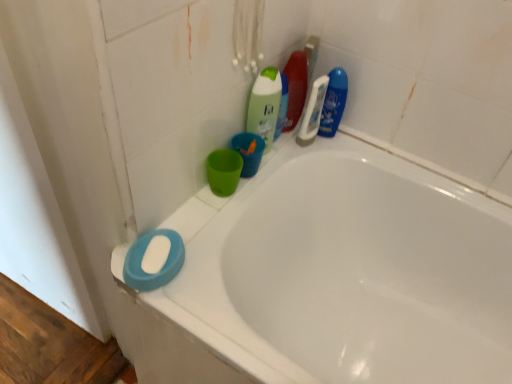
Question: Can you confirm if green matte bottle at upper center, the fourth cleaning product when ordered from right to left, is positioned to the left of white matte soap at lower left?

Choices:
 (A) yes
 (B) no

Answer: (B)

Question: Is green matte bottle at upper center, the first cleaning product positioned from the left, not close to white matte soap at lower left?

Choices:
 (A) yes
 (B) no

Answer: (B)

Question: Is green matte bottle at upper center, the fourth cleaning product when ordered from right to left, facing away from white matte soap at lower left?

Choices:
 (A) yes
 (B) no

Answer: (B)

Question: From the image's perspective, does green matte bottle at upper center, the fourth cleaning product when ordered from right to left, appear lower than white matte soap at lower left?

Choices:
 (A) yes
 (B) no

Answer: (B)

Question: From a real-world perspective, is green matte bottle at upper center, the fourth cleaning product when ordered from right to left, beneath white matte soap at lower left?

Choices:
 (A) yes
 (B) no

Answer: (B)

Question: Are green matte bottle at upper center, the fourth cleaning product when ordered from right to left, and white matte soap at lower left making contact?

Choices:
 (A) no
 (B) yes

Answer: (A)

Question: Does matte plastic cup at upper center have a greater width compared to translucent plastic bottle at upper center, the third cleaning product positioned from the right?

Choices:
 (A) yes
 (B) no

Answer: (A)

Question: Is matte plastic cup at upper center behind translucent plastic bottle at upper center, which is counted as the second cleaning product, starting from the left?

Choices:
 (A) no
 (B) yes

Answer: (A)

Question: Is matte plastic cup at upper center at the left side of translucent plastic bottle at upper center, the third cleaning product positioned from the right?

Choices:
 (A) yes
 (B) no

Answer: (A)

Question: Considering the relative sizes of matte plastic cup at upper center and translucent plastic bottle at upper center, which is counted as the second cleaning product, starting from the left, in the image provided, is matte plastic cup at upper center smaller than translucent plastic bottle at upper center, which is counted as the second cleaning product, starting from the left,?

Choices:
 (A) yes
 (B) no

Answer: (A)

Question: From a real-world perspective, is matte plastic cup at upper center positioned under translucent plastic bottle at upper center, which is counted as the second cleaning product, starting from the left, based on gravity?

Choices:
 (A) yes
 (B) no

Answer: (A)

Question: From the image's perspective, would you say matte plastic cup at upper center is shown under translucent plastic bottle at upper center, the third cleaning product positioned from the right?

Choices:
 (A) no
 (B) yes

Answer: (B)

Question: Is white glossy bathtub at lower left at the left side of blue glossy bottle at upper right, the 4th cleaning product from the left?

Choices:
 (A) no
 (B) yes

Answer: (A)